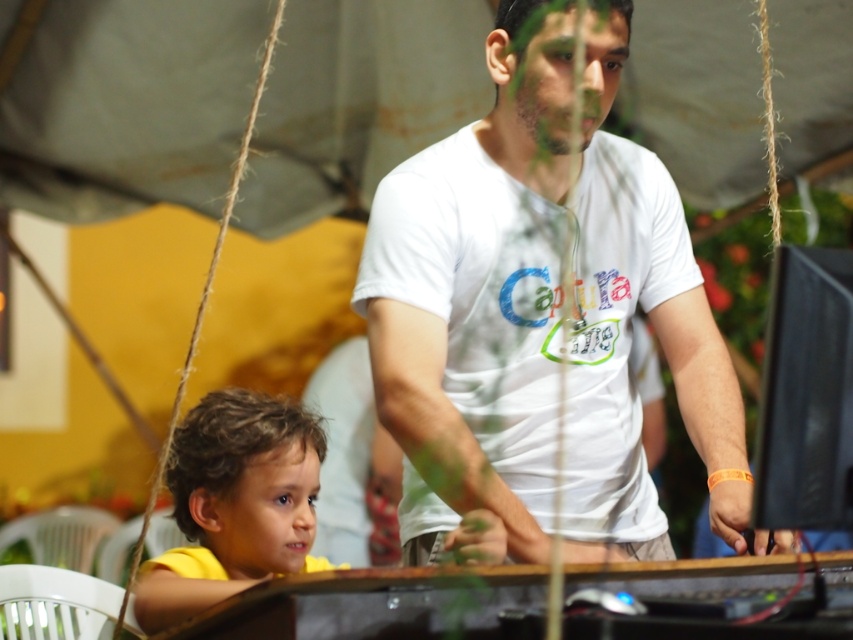
You are a photographer at the event and want to capture a photo of the yellow matte shirt at lower left and the smooth brown hair at lower left. Which object should you focus on first if you need to adjust your camera settings for larger objects?

The yellow matte shirt at lower left is larger in size than the smooth brown hair at lower left, so you should focus on the yellow matte shirt at lower left first.